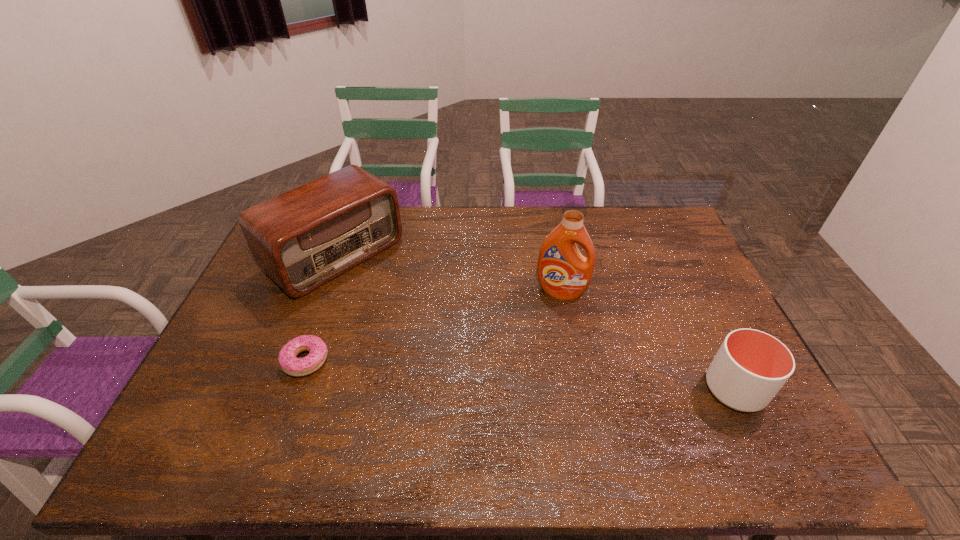
Where is `blank space at the far edge of the desktop`? blank space at the far edge of the desktop is located at coordinates (536, 227).

Identify the location of vacant area at the near edge. (673, 392).

Where is `vacant space at the left edge of the desktop`? The width and height of the screenshot is (960, 540). vacant space at the left edge of the desktop is located at coordinates (276, 307).

Find the location of a particular element. The height and width of the screenshot is (540, 960). vacant space at the right edge is located at coordinates (693, 317).

You are a GUI agent. You are given a task and a screenshot of the screen. Output one action in this format:
    pyautogui.click(x=<x>, y=<y>)
    Task: Click on the vacant space at the far right corner
    
    Given the screenshot: What is the action you would take?
    pyautogui.click(x=643, y=242)

Locate an element on the screen. The width and height of the screenshot is (960, 540). blank region between the third tallest object and the radio receiver is located at coordinates (535, 322).

Identify the location of vacant point located between the rightmost object and the doughnut. The height and width of the screenshot is (540, 960). (520, 375).

Identify the location of vacant point located between the radio receiver and the shortest object. The width and height of the screenshot is (960, 540). (321, 307).

I want to click on vacant space that is in between the third object from left to right and the radio receiver, so click(x=447, y=273).

You are a GUI agent. You are given a task and a screenshot of the screen. Output one action in this format:
    pyautogui.click(x=<x>, y=<y>)
    Task: Click on the blank region between the third tallest object and the doughnut
    The width and height of the screenshot is (960, 540).
    Given the screenshot: What is the action you would take?
    pyautogui.click(x=520, y=375)